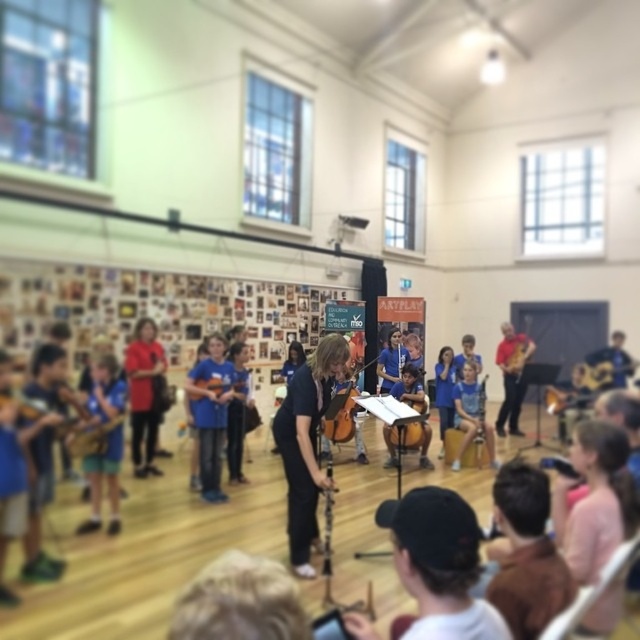
Who is more forward, (349, 376) or (417, 410)?

Point (349, 376)

Is point (356, 413) in front of point (403, 397)?

No, it is behind (403, 397).

Locate an element on the screen. This screenshot has width=640, height=640. wooden polished cello at center is located at coordinates (352, 358).

You are a GUI agent. You are given a task and a screenshot of the screen. Output one action in this format:
    pyautogui.click(x=<x>, y=<y>)
    Task: Click on the wooden polished cello at center
    The width and height of the screenshot is (640, 640).
    Given the screenshot: What is the action you would take?
    pyautogui.click(x=352, y=358)

Who is shorter, black matte clarinet at center or matte brown violin at center?

matte brown violin at center is shorter.

Can you confirm if black matte clarinet at center is smaller than matte brown violin at center?

No, black matte clarinet at center is not smaller than matte brown violin at center.

Image resolution: width=640 pixels, height=640 pixels. What do you see at coordinates (307, 444) in the screenshot?
I see `black matte clarinet at center` at bounding box center [307, 444].

Where is `black matte clarinet at center`? The width and height of the screenshot is (640, 640). black matte clarinet at center is located at coordinates (307, 444).

Does matte brown violin at center lie in front of wooden polished cello at center?

No, matte brown violin at center is further to the viewer.

Does point (116, 417) lie in front of point (355, 364)?

Yes, it is.

This screenshot has width=640, height=640. Identify the location of matte brown violin at center. (92, 436).